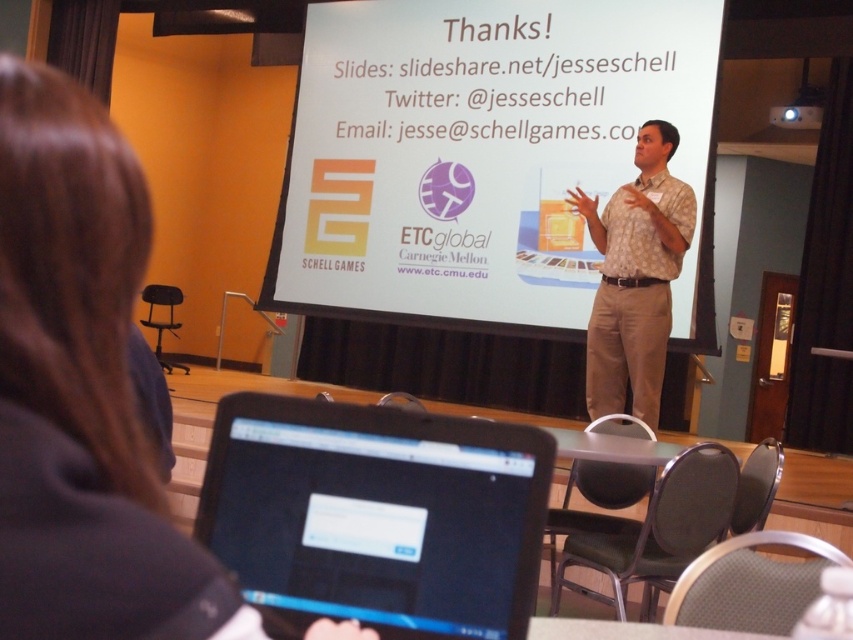
Question: Which of the following is the closest to the observer?

Choices:
 (A) black glossy laptop at lower center
 (B) brown hair at upper left
 (C) white paper at center
 (D) white plastic projector at upper right

Answer: (B)

Question: Does brown hair at upper left have a greater width compared to brown patterned shirt at center?

Choices:
 (A) no
 (B) yes

Answer: (A)

Question: Which object is farther from the camera taking this photo?

Choices:
 (A) black glossy laptop at lower center
 (B) brown hair at upper left

Answer: (A)

Question: Estimate the real-world distances between objects in this image. Which object is farther from the white plastic projector at upper right?

Choices:
 (A) white paper at center
 (B) black glossy laptop at lower center
 (C) brown patterned shirt at center
 (D) brown hair at upper left

Answer: (D)

Question: Is brown hair at upper left wider than white plastic projector at upper right?

Choices:
 (A) no
 (B) yes

Answer: (A)

Question: Can you confirm if brown hair at upper left is positioned to the right of white plastic projector at upper right?

Choices:
 (A) yes
 (B) no

Answer: (B)